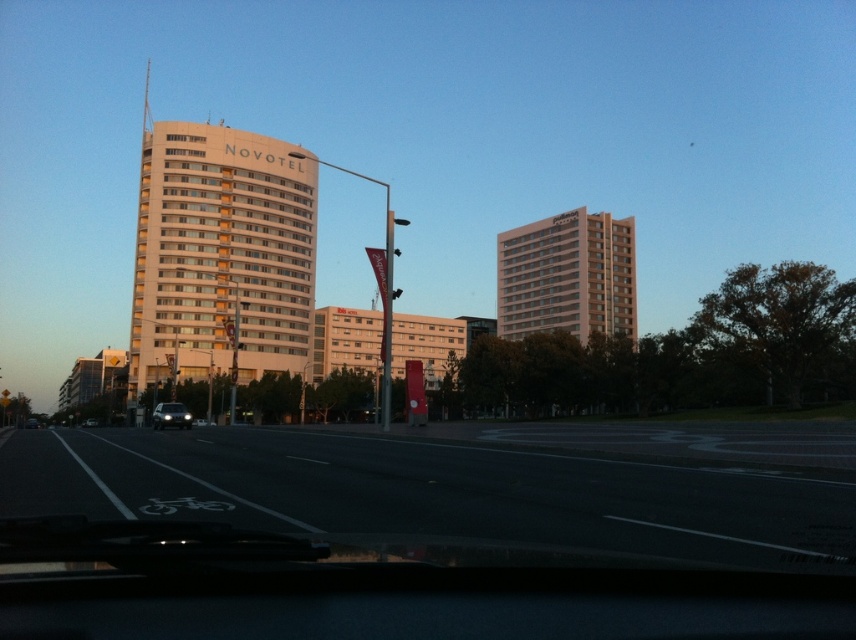
Question: Which object is the closest to the beige smooth building at upper center?

Choices:
 (A) silver metallic sedan at center
 (B) white smooth building at center

Answer: (B)

Question: Which object appears closest to the camera in this image?

Choices:
 (A) beige smooth building at upper center
 (B) shiny silver car at center
 (C) silver metallic sedan at center
 (D) white smooth building at center

Answer: (B)

Question: Which point appears closest to the camera in this image?

Choices:
 (A) (186, 410)
 (B) (629, 278)

Answer: (A)

Question: Is shiny silver car at center below matte black car at center?

Choices:
 (A) no
 (B) yes

Answer: (A)

Question: Can you confirm if white smooth building at center is bigger than beige smooth building at upper center?

Choices:
 (A) yes
 (B) no

Answer: (A)

Question: Does beige smooth building at upper center appear over shiny silver car at center?

Choices:
 (A) yes
 (B) no

Answer: (A)